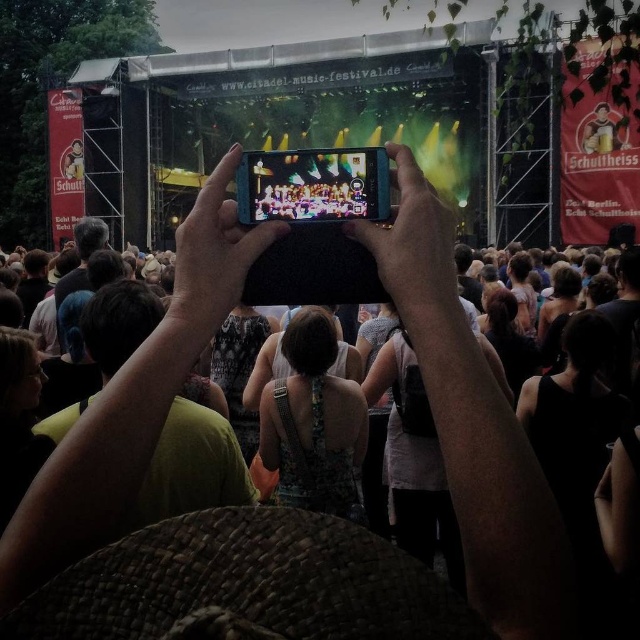
Is point (419, 221) positioned before point (179, 252)?

That is False.

Does black matte phone at center have a lesser width compared to smooth black phone at center?

No, black matte phone at center is not thinner than smooth black phone at center.

At what (x,y) coordinates should I click in order to perform the action: click on black matte phone at center. Please return your answer as a coordinate pair (x, y). The width and height of the screenshot is (640, 640). Looking at the image, I should click on (413, 244).

Can you confirm if dark fabric crowd at center is thinner than black matte phone at center?

No.

Which is more to the left, dark fabric crowd at center or black matte phone at center?

dark fabric crowd at center is more to the left.

Does point (72, 540) come closer to viewer compared to point (451, 280)?

Yes, point (72, 540) is in front of point (451, 280).

Locate an element on the screen. The image size is (640, 640). dark fabric crowd at center is located at coordinates (497, 497).

Between dark fabric crowd at center and smooth black phone at center, which one appears on the left side from the viewer's perspective?

From the viewer's perspective, smooth black phone at center appears more on the left side.

What do you see at coordinates (497, 497) in the screenshot?
I see `dark fabric crowd at center` at bounding box center [497, 497].

Where is `dark fabric crowd at center`? dark fabric crowd at center is located at coordinates (497, 497).

Locate an element on the screen. This screenshot has height=640, width=640. dark fabric crowd at center is located at coordinates (497, 497).